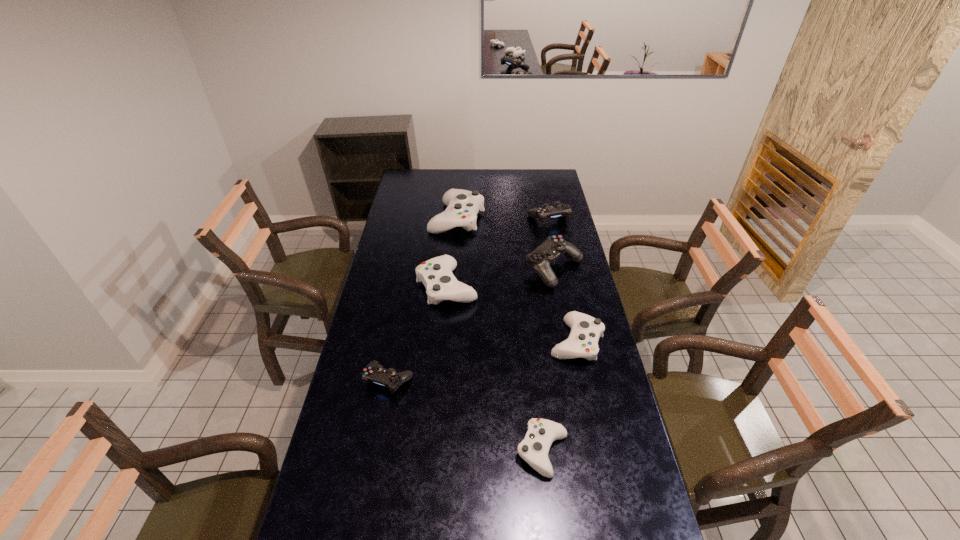
Point out which black control is positioned as the third nearest to the nearest white control. Please provide its 2D coordinates. Your answer should be formatted as a tuple, i.e. [(x, y)], where the tuple contains the x and y coordinates of a point satisfying the conditions above.

[(558, 210)]

This screenshot has height=540, width=960. I want to click on black control that is the closest to the biggest black control, so click(558, 210).

This screenshot has height=540, width=960. What are the coordinates of `vacant position in the image that satisfies the following two spatial constraints: 1. on the back side of the farthest white control; 2. on the right side of the second smallest black control` in the screenshot? It's located at (457, 218).

At what (x,y) coordinates should I click in order to perform the action: click on vacant region that satisfies the following two spatial constraints: 1. on the back side of the smallest black control; 2. on the left side of the second farthest white control. Please return your answer as a coordinate pair (x, y). The height and width of the screenshot is (540, 960). Looking at the image, I should click on (406, 286).

Identify the location of free point that satisfies the following two spatial constraints: 1. on the front side of the third farthest white control; 2. on the left side of the biggest white control. (448, 341).

Locate an element on the screen. vacant space that satisfies the following two spatial constraints: 1. on the back side of the nearest black control; 2. on the left side of the biggest black control is located at coordinates (410, 269).